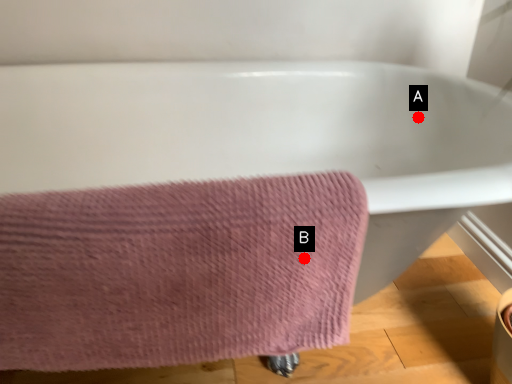
Question: Two points are circled on the image, labeled by A and B beside each circle. Which point appears closest to the camera in this image?

Choices:
 (A) A is closer
 (B) B is closer

Answer: (B)